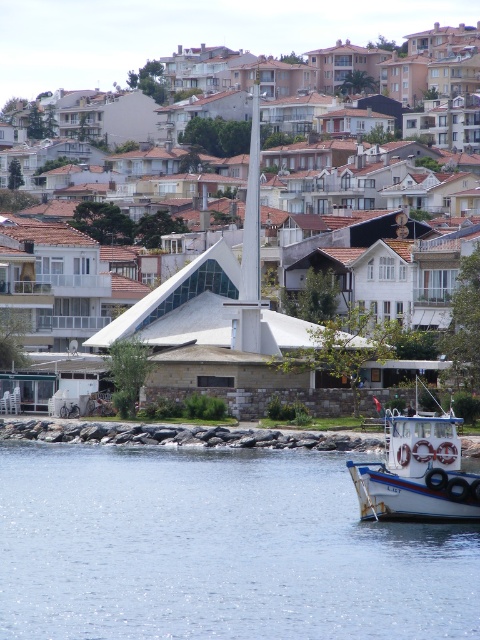
You are standing at the center of the modern building with a triangular roof and want to reach the clear water at lower left. According to the coordinates provided, in which direction should you walk to get there?

The clear water at lower left is located at coordinates point (216, 548), so you should walk towards the lower left direction to reach it.

You are standing on the shore looking at the clear water at lower left and the white plastic boat at lower right. Which object is closer to your left side?

The clear water at lower left is closer to your left side since it is positioned to the left of the white plastic boat at lower right.